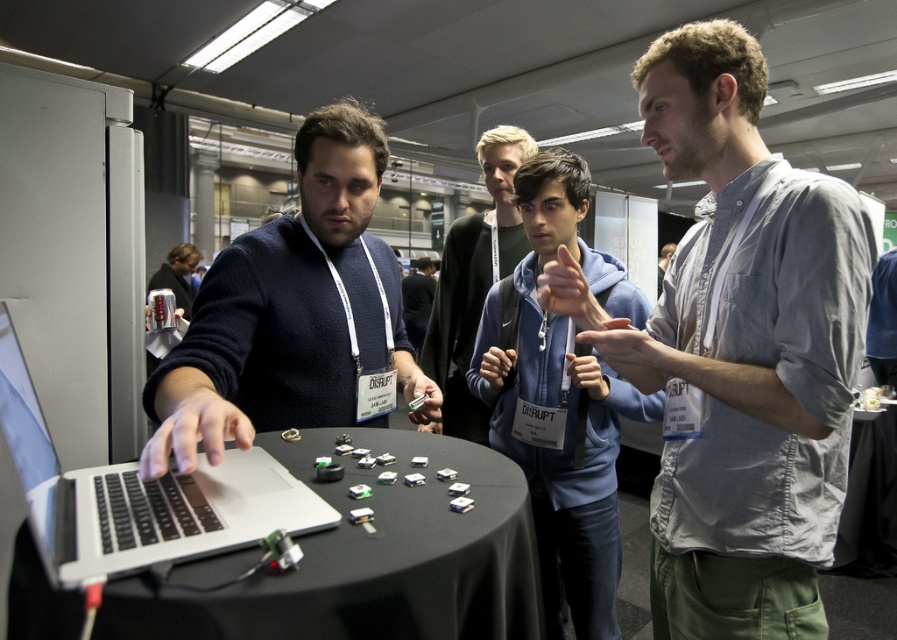
Question: Which object is the closest to the silver metallic laptop at center?

Choices:
 (A) dark green sweater at center
 (B) dark blue sweater at center
 (C) dark blue hoodie at center
 (D) black fabric table at center

Answer: (D)

Question: Is black fabric table at center below blue fleece jacket at center?

Choices:
 (A) no
 (B) yes

Answer: (A)

Question: Can you confirm if blue fleece jacket at center is positioned to the right of dark green sweater at center?

Choices:
 (A) no
 (B) yes

Answer: (B)

Question: Which is nearer to the silver metallic laptop at center?

Choices:
 (A) gray cotton shirt at center
 (B) dark blue hoodie at center

Answer: (A)

Question: Can you confirm if dark blue sweater at center is positioned above dark blue hoodie at center?

Choices:
 (A) no
 (B) yes

Answer: (A)

Question: Which point is farther from the camera taking this photo?

Choices:
 (A) (547, 348)
 (B) (745, 131)
 (C) (179, 268)

Answer: (C)